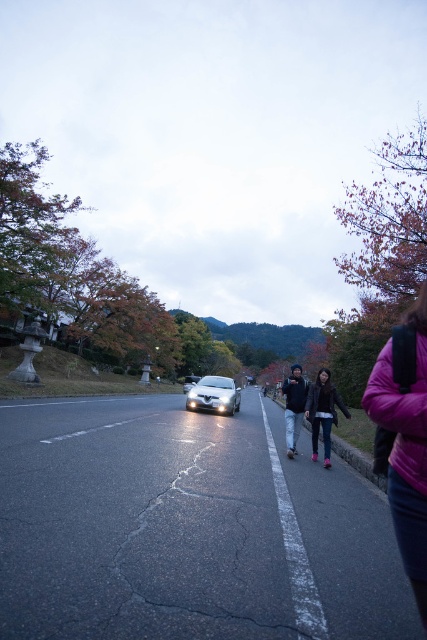
Does dark brown leather jacket at center lie in front of glossy white car at center?

Yes, it is.

Does dark brown leather jacket at center appear over glossy white car at center?

Indeed, dark brown leather jacket at center is positioned over glossy white car at center.

Is point (306, 417) farther from camera compared to point (195, 381)?

That is False.

Identify the location of dark brown leather jacket at center. This screenshot has width=427, height=640. (322, 412).

Can you confirm if purple fleece jacket at lower right is positioned to the right of glossy white car at center?

Correct, you'll find purple fleece jacket at lower right to the right of glossy white car at center.

Is purple fleece jacket at lower right thinner than glossy white car at center?

Yes, purple fleece jacket at lower right is thinner than glossy white car at center.

Does point (409, 532) come behind point (186, 384)?

No, it is not.

Locate an element on the screen. purple fleece jacket at lower right is located at coordinates (404, 436).

Which of these two, purple fleece jacket at lower right or dark blue jeans at center, stands taller?

Standing taller between the two is dark blue jeans at center.

Which is above, purple fleece jacket at lower right or dark blue jeans at center?

purple fleece jacket at lower right

Which is behind, point (424, 285) or point (295, 374)?

The point (295, 374) is behind.

At what (x,y) coordinates should I click in order to perform the action: click on purple fleece jacket at lower right. Please return your answer as a coordinate pair (x, y). The image size is (427, 640). Looking at the image, I should click on (404, 436).